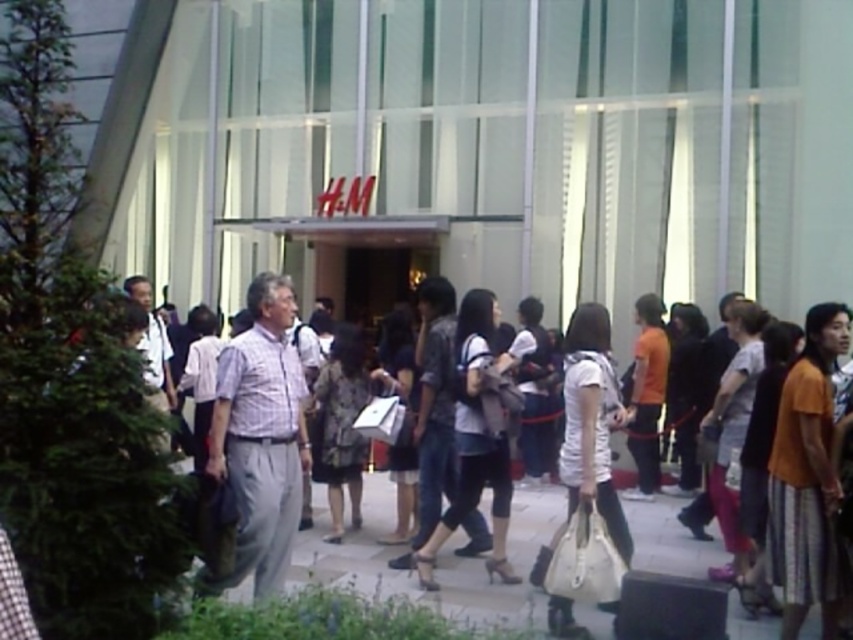
You are a photographer trying to capture a clear shot of the H and M entrance. You notice the smooth concrete pavement at center and the light brown fabric shirt at center in your frame. Which object should you adjust your camera to focus on to ensure the H and M entrance is centered in your shot?

The smooth concrete pavement at center is positioned on the right side of light brown fabric shirt at center. To center the H and M entrance, focus on the light brown fabric shirt at center since it is closer to the entrance area.

You are standing at the entrance of the H M store and see a light brown fabric shirt at center and a white shirt at center. How far apart are these two shirts from each other?

The light brown fabric shirt at center is 5.27 feet away from the white shirt at center.

Please describe the exact position of the light brown fabric shirt at center in the image using coordinates.

The light brown fabric shirt at center is located at coordinates point (260,438).